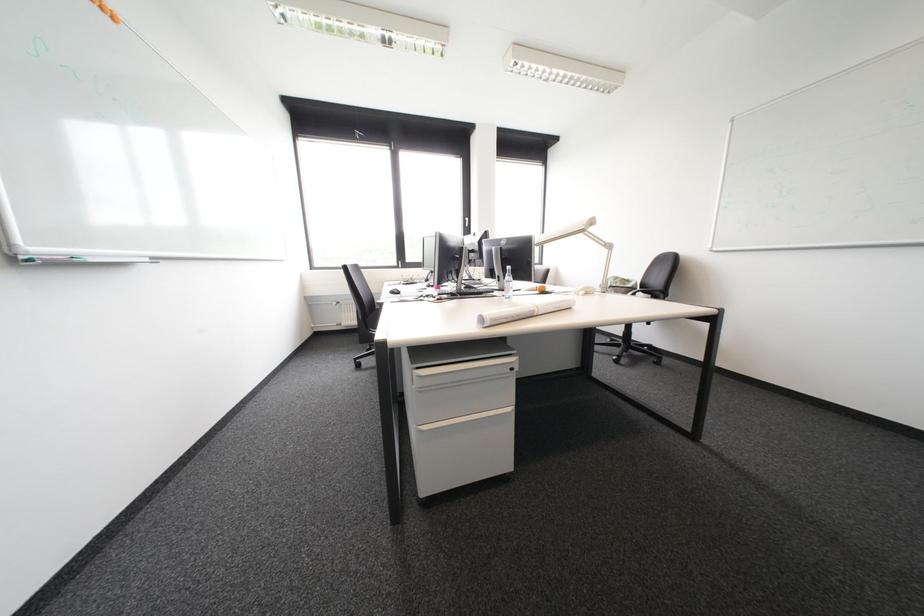
Where would you click the black computer mouse? Please return your answer as a coordinate pair (x, y).

(394, 291)